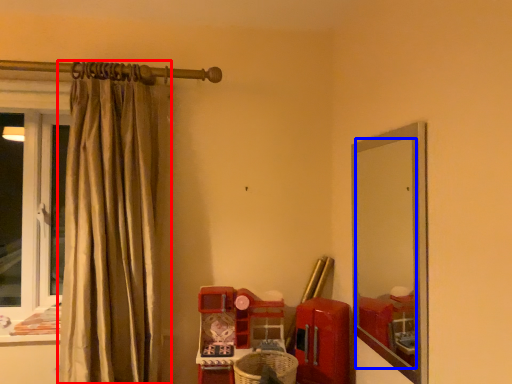
Question: Which object is further to the camera taking this photo, curtain (highlighted by a red box) or mirror (highlighted by a blue box)?

Choices:
 (A) curtain
 (B) mirror

Answer: (A)